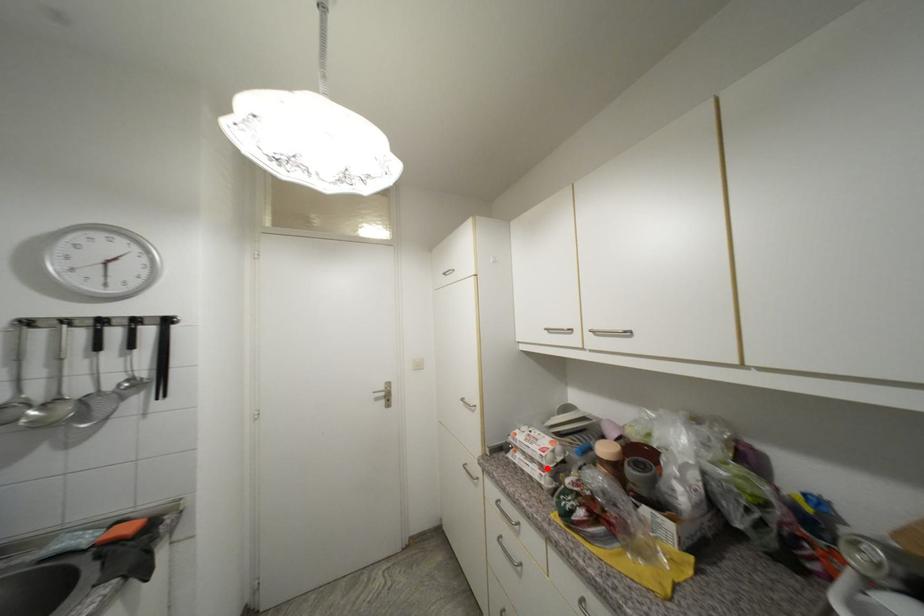
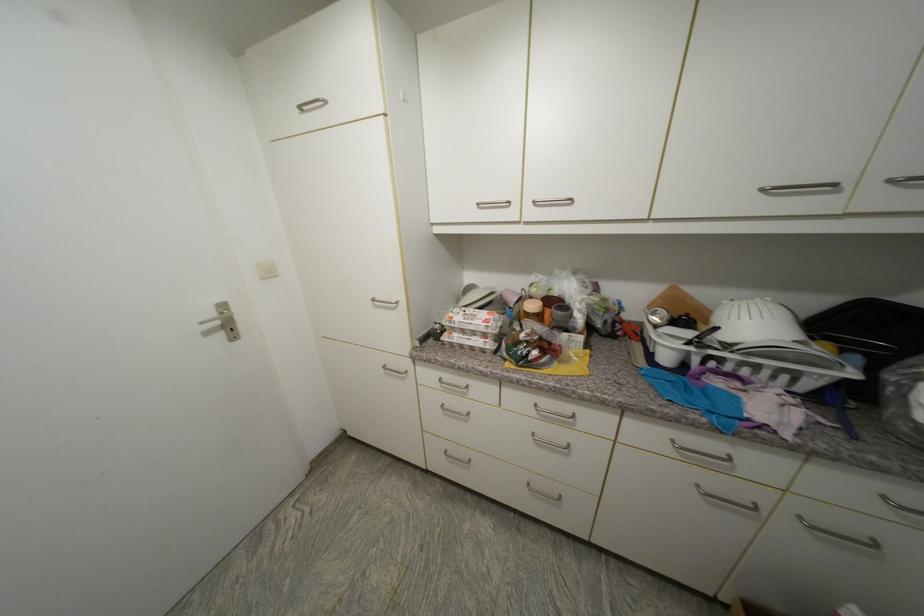
Where in the second image is the point corresponding to the highlighted location from the first image?

(490, 337)